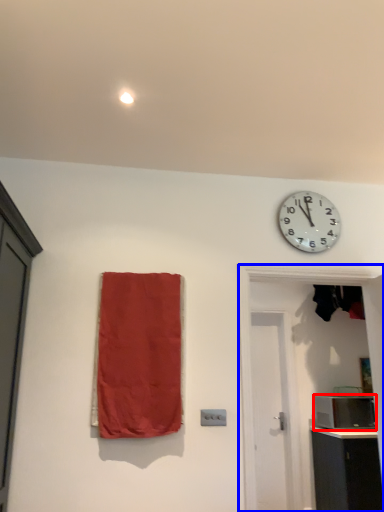
Question: Which object is further to the camera taking this photo, appliance (highlighted by a red box) or door (highlighted by a blue box)?

Choices:
 (A) appliance
 (B) door

Answer: (A)